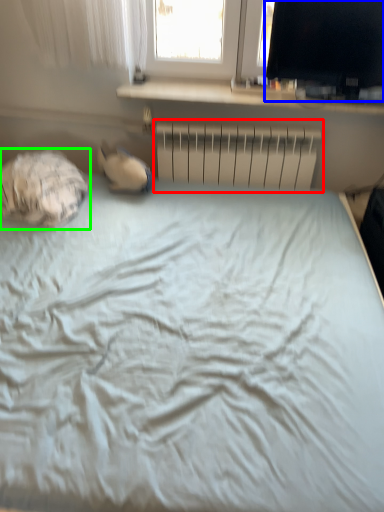
Question: Which is farther away from radiator (highlighted by a red box)? computer monitor (highlighted by a blue box) or sleeping bag (highlighted by a green box)?

Choices:
 (A) computer monitor
 (B) sleeping bag

Answer: (B)